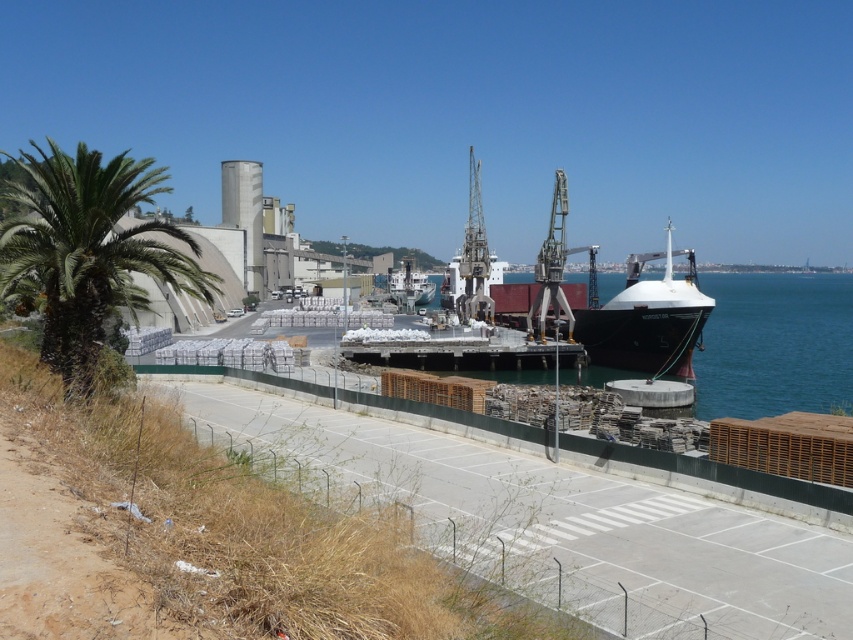
Question: Can you confirm if green leafy palm tree at left is wider than white matte boat at center?

Choices:
 (A) no
 (B) yes

Answer: (B)

Question: Which point is closer to the camera?

Choices:
 (A) white matte boat at center
 (B) green leafy palm tree at left

Answer: (B)

Question: From the image, what is the correct spatial relationship of green leafy palm tree at left in relation to white matte boat at center?

Choices:
 (A) below
 (B) above

Answer: (A)

Question: Which point is closer to the camera?

Choices:
 (A) green leafy palm tree at left
 (B) white matte boat at center

Answer: (A)

Question: Can you confirm if green leafy palm tree at left is thinner than white matte boat at center?

Choices:
 (A) no
 (B) yes

Answer: (A)